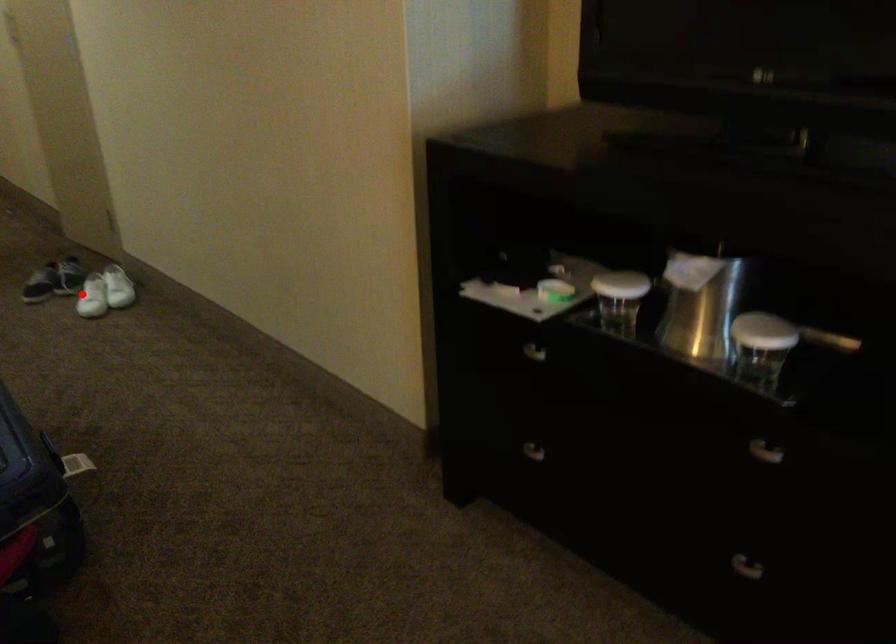
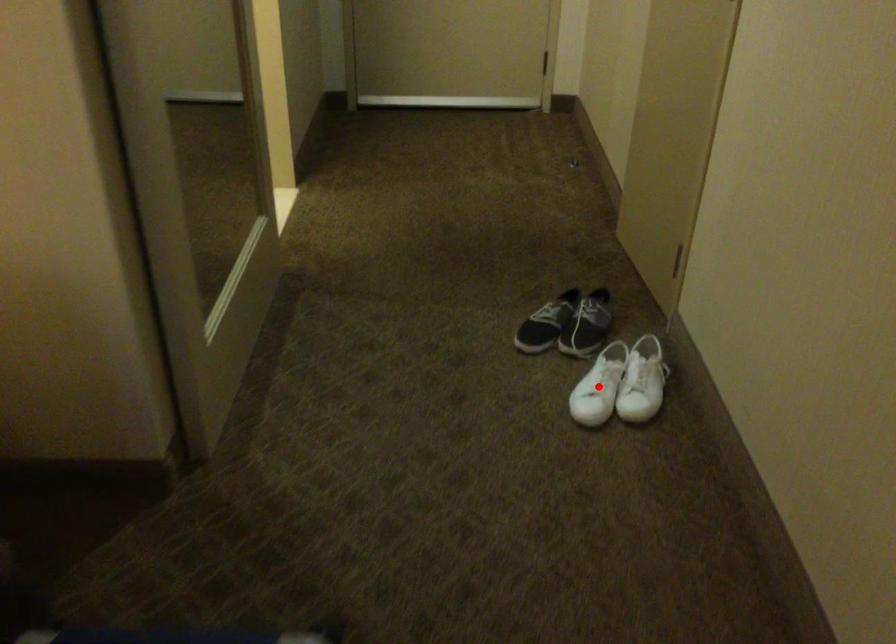
I am providing you with two images of the same scene from different viewpoints. A red point is marked on the first image and another point is marked on the second image. Is the marked point in image1 the same physical position as the marked point in image2?

Yes